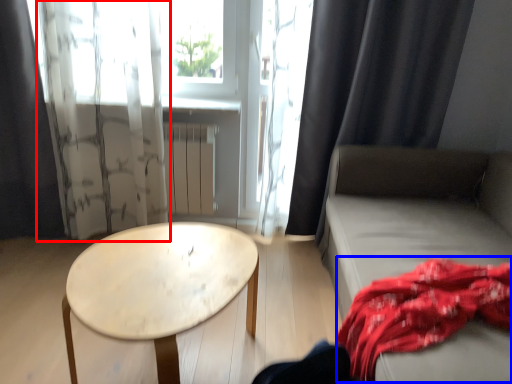
Question: Which object is further to the camera taking this photo, curtain (highlighted by a red box) or blanket (highlighted by a blue box)?

Choices:
 (A) curtain
 (B) blanket

Answer: (A)